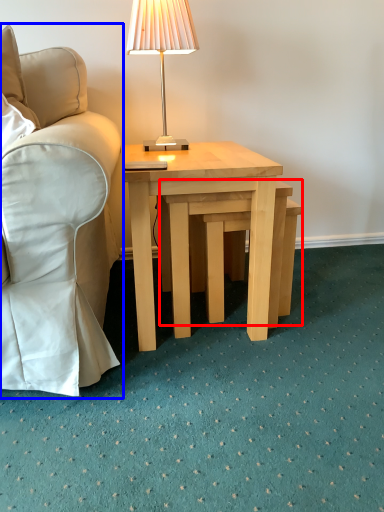
Question: Which point is further to the camera, step stool (highlighted by a red box) or chair (highlighted by a blue box)?

Choices:
 (A) step stool
 (B) chair

Answer: (A)